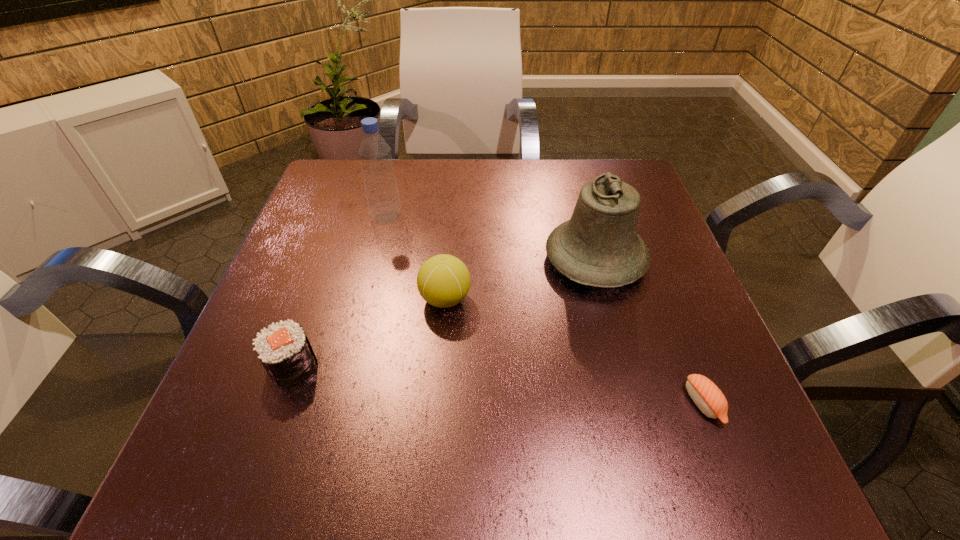
I want to click on free point between the farthest object and the left sushi, so click(339, 292).

Find the location of a particular element. The image size is (960, 540). vacant area that lies between the shortest object and the third object from left to right is located at coordinates (574, 351).

Where is `empty space that is in between the shorter sushi and the tallest object`? Image resolution: width=960 pixels, height=540 pixels. empty space that is in between the shorter sushi and the tallest object is located at coordinates (544, 310).

This screenshot has width=960, height=540. I want to click on vacant area between the second tallest object and the third shortest object, so click(520, 279).

The image size is (960, 540). I want to click on vacant area that lies between the bell and the taller sushi, so click(444, 313).

I want to click on unoccupied area between the leftmost object and the fourth shortest object, so click(x=444, y=313).

The image size is (960, 540). Find the location of `empty space that is in between the bell and the tallest object`. empty space that is in between the bell and the tallest object is located at coordinates (491, 239).

Choose which object is the fourth nearest neighbor to the taller sushi. Please provide its 2D coordinates. Your answer should be formatted as a tuple, i.e. [(x, y)], where the tuple contains the x and y coordinates of a point satisfying the conditions above.

[(706, 395)]

Find the location of a particular element. This screenshot has height=540, width=960. the fourth closest object to the taller sushi is located at coordinates (706, 395).

Locate an element on the screen. The height and width of the screenshot is (540, 960). vacant region that satisfies the following two spatial constraints: 1. on the back side of the second tallest object; 2. on the right side of the left sushi is located at coordinates (329, 260).